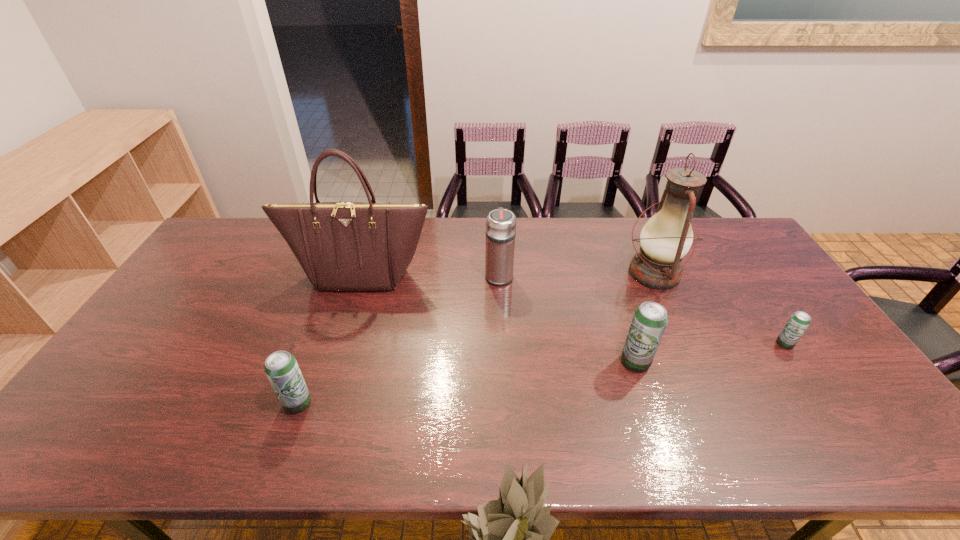
The image size is (960, 540). I want to click on free spot located on the left of the second tallest beer can, so click(x=219, y=403).

At what (x,y) coordinates should I click in order to perform the action: click on vacant space situated 0.300m on the right of the second farthest beer can. Please return your answer as a coordinate pair (x, y). Looking at the image, I should click on (763, 362).

Locate an element on the screen. This screenshot has height=540, width=960. free spot located on the back of the farthest beer can is located at coordinates (747, 287).

This screenshot has width=960, height=540. I want to click on vacant space situated on the front-facing side of the handbag, so click(x=326, y=385).

This screenshot has height=540, width=960. What are the coordinates of `vacant space situated on the right of the fifth object from left to right` in the screenshot? It's located at (737, 273).

The image size is (960, 540). I want to click on blank space located 0.190m with a handle on the side of the third tallest object, so pyautogui.click(x=497, y=231).

Locate an element on the screen. Image resolution: width=960 pixels, height=540 pixels. vacant space located with a handle on the side of the third tallest object is located at coordinates (496, 222).

Where is `free space located 0.230m with a handle on the side of the third tallest object`? The height and width of the screenshot is (540, 960). free space located 0.230m with a handle on the side of the third tallest object is located at coordinates (496, 225).

This screenshot has height=540, width=960. I want to click on object situated at the far edge, so click(667, 236).

The image size is (960, 540). Find the location of `object that is at the near edge`. object that is at the near edge is located at coordinates click(281, 367).